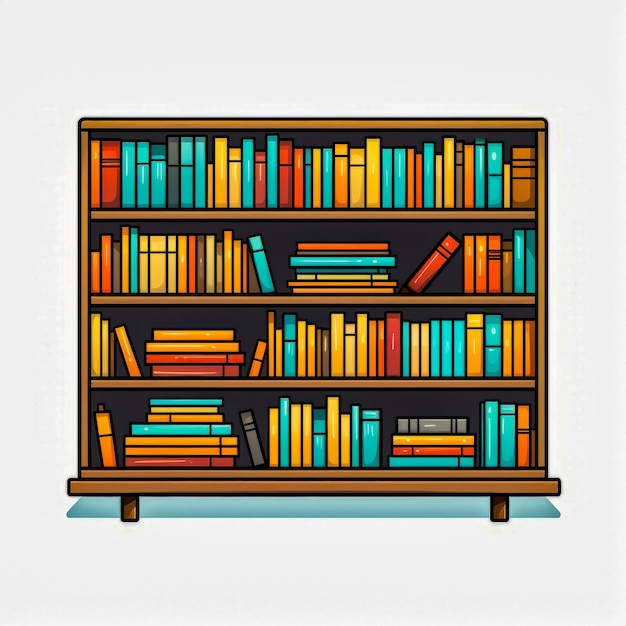
At what (x,y) coordinates should I click in order to perform the action: click on stacks of books. Please return your answer as a coordinate pair (x, y). The height and width of the screenshot is (626, 626). Looking at the image, I should click on [342, 258], [223, 362], [210, 428], [408, 438].